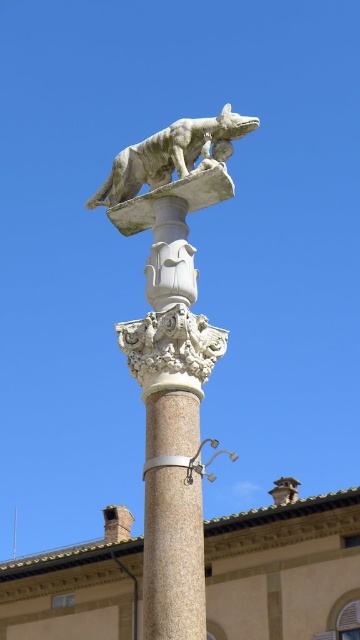
Is white marble wolf at upper center to the left of granite column at center from the viewer's perspective?

Indeed, white marble wolf at upper center is positioned on the left side of granite column at center.

Is point (182, 147) less distant than point (149, 541)?

That is False.

Describe the element at coordinates (172, 349) in the screenshot. I see `white marble wolf at upper center` at that location.

This screenshot has height=640, width=360. I want to click on white marble wolf at upper center, so 172,349.

From the picture: Between gray stone wolf at upper center and metallic silver lamp post at center, which one has more height?

Standing taller between the two is gray stone wolf at upper center.

Can you confirm if gray stone wolf at upper center is smaller than metallic silver lamp post at center?

Incorrect, gray stone wolf at upper center is not smaller in size than metallic silver lamp post at center.

Where is `gray stone wolf at upper center`? This screenshot has width=360, height=640. gray stone wolf at upper center is located at coordinates (172, 154).

I want to click on gray stone wolf at upper center, so click(x=172, y=154).

Which is behind, point (155, 396) or point (136, 180)?

Point (136, 180)

Does point (155, 600) come closer to viewer compared to point (213, 160)?

Yes.

Find the location of `granite column at center`. granite column at center is located at coordinates (173, 522).